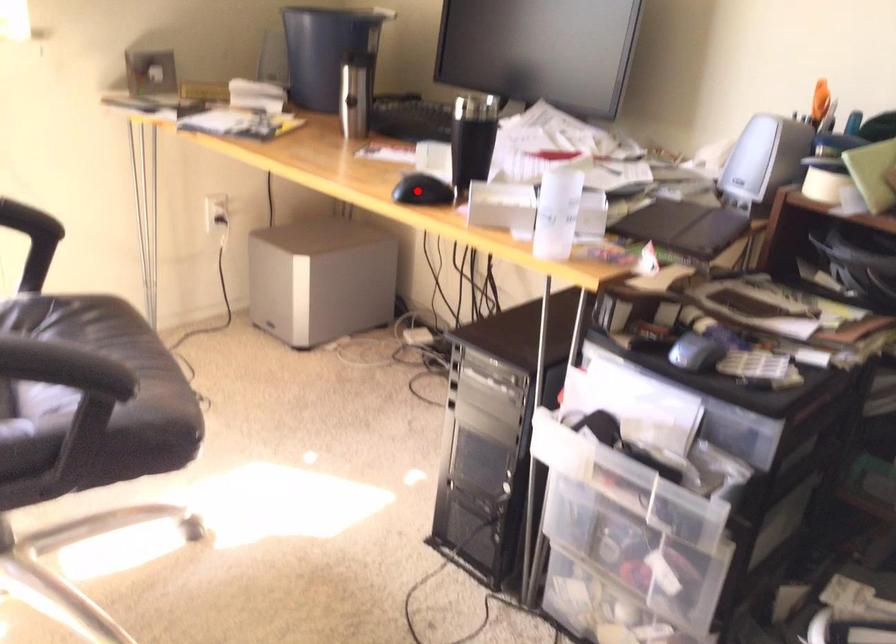
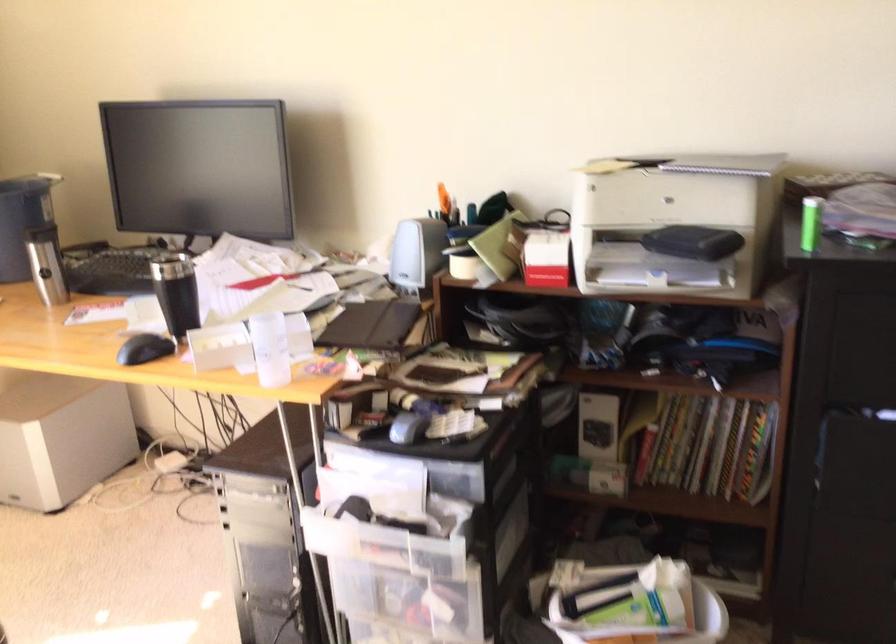
Find the pixel in the second image that matches the highlighted location in the first image.

(143, 348)